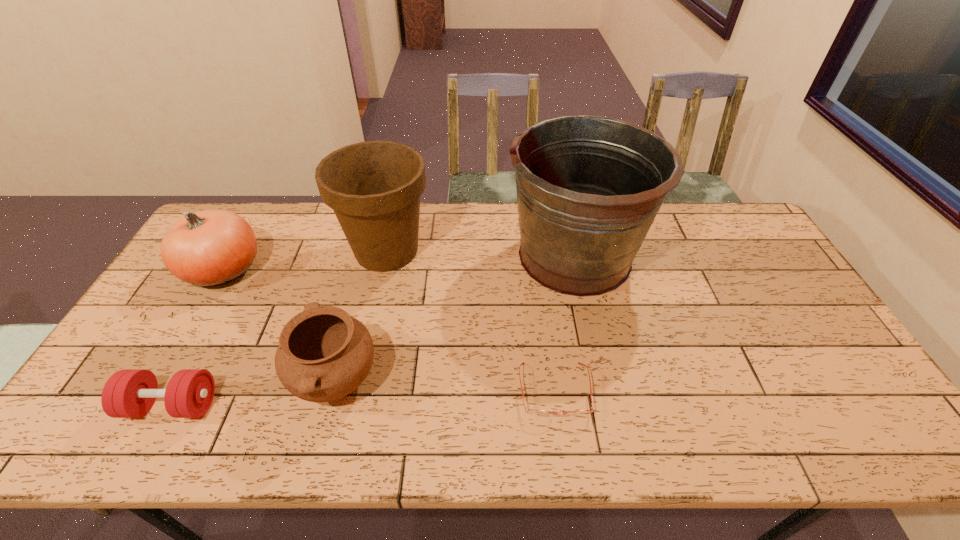
This screenshot has width=960, height=540. I want to click on vacant point located on the back of the dumbbell, so click(210, 334).

At what (x,y) coordinates should I click in order to perform the action: click on free space located 0.070m on the lenses of the spectacles. Please return your answer as a coordinate pair (x, y). The image size is (960, 540). Looking at the image, I should click on (563, 451).

Identify the location of bucket at the far edge. (588, 188).

This screenshot has width=960, height=540. What are the coordinates of `flowerpot that is at the far edge` in the screenshot? It's located at (374, 187).

Where is `pumpkin present at the far edge`? The height and width of the screenshot is (540, 960). pumpkin present at the far edge is located at coordinates coord(207,248).

Find the location of `pottery that is at the near edge`. pottery that is at the near edge is located at coordinates (324, 354).

The image size is (960, 540). I want to click on dumbbell present at the near edge, so click(x=130, y=393).

Where is `spectacles located in the near edge section of the desktop`? spectacles located in the near edge section of the desktop is located at coordinates (536, 413).

Find the location of a particular element. The image size is (960, 540). pumpkin that is at the left edge is located at coordinates (207, 248).

The image size is (960, 540). Find the location of `dumbbell that is at the left edge`. dumbbell that is at the left edge is located at coordinates (130, 393).